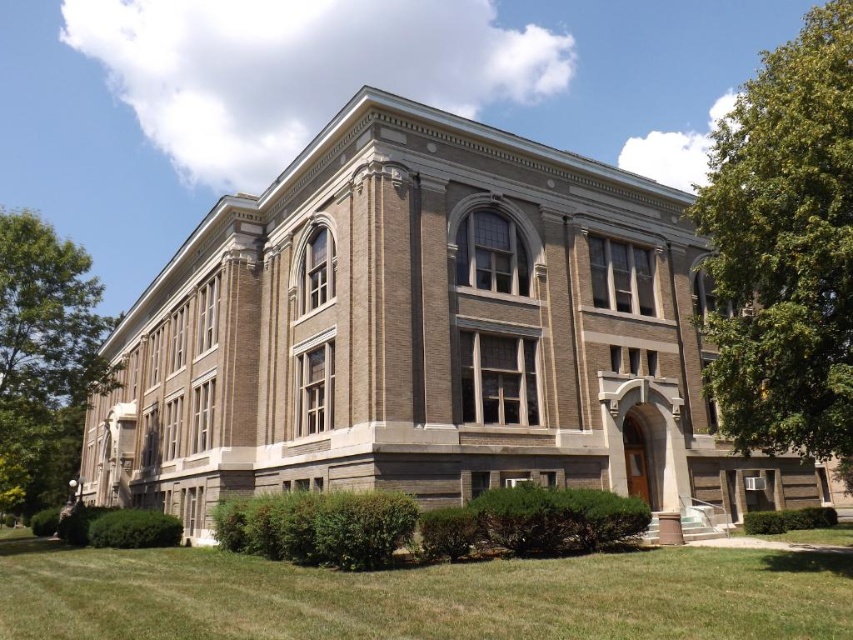
Question: Which object is the farthest from the green leafy tree at left?

Choices:
 (A) green leafy tree at right
 (B) green grass at lower center

Answer: (A)

Question: Based on their relative distances, which object is farther from the green leafy tree at left?

Choices:
 (A) green grass at lower center
 (B) green leafy tree at right

Answer: (B)

Question: Is green grass at lower center positioned before green leafy tree at left?

Choices:
 (A) no
 (B) yes

Answer: (B)

Question: Is green grass at lower center to the right of green leafy tree at right from the viewer's perspective?

Choices:
 (A) yes
 (B) no

Answer: (B)

Question: Is green grass at lower center closer to the viewer compared to green leafy tree at left?

Choices:
 (A) yes
 (B) no

Answer: (A)

Question: Estimate the real-world distances between objects in this image. Which object is farther from the green leafy tree at left?

Choices:
 (A) green grass at lower center
 (B) green leafy tree at right

Answer: (B)